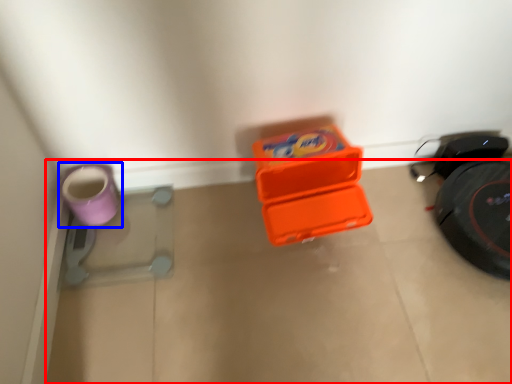
Question: Which point is closer to the camera, concrete (highlighted by a red box) or footwear (highlighted by a blue box)?

Choices:
 (A) concrete
 (B) footwear

Answer: (A)